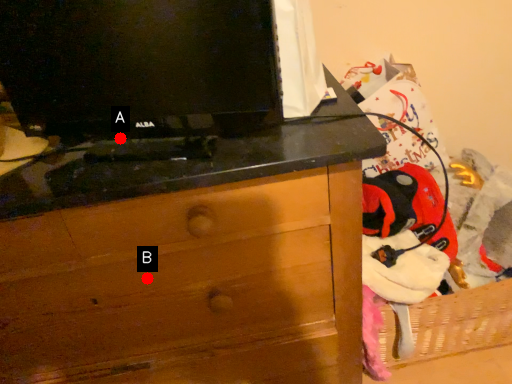
Question: Two points are circled on the image, labeled by A and B beside each circle. Which point is farther to the camera?

Choices:
 (A) A is further
 (B) B is further

Answer: (B)